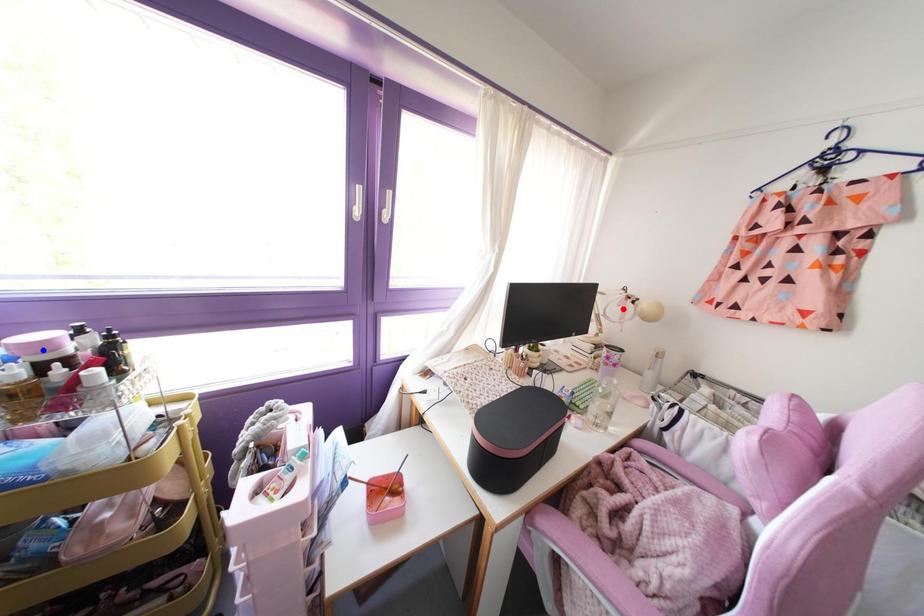
Question: In the image, two points are highlighted. Which point is nearer to the camera? Reply with the corresponding letter.

Choices:
 (A) blue point
 (B) red point

Answer: (A)